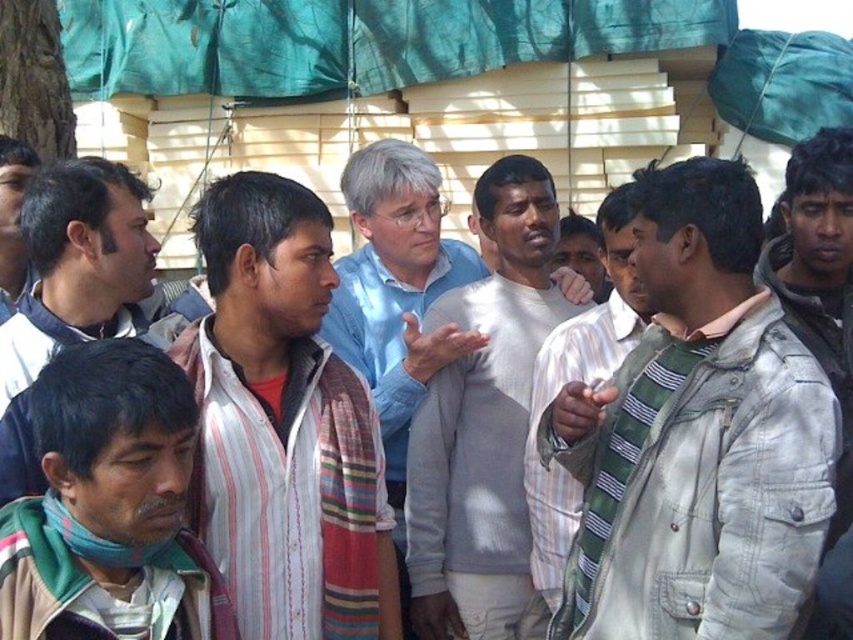
Question: Which point is farther from the camera taking this photo?

Choices:
 (A) click(486, 205)
 (B) click(584, 323)
 (C) click(396, 284)

Answer: (C)

Question: Can you confirm if white striped shirt at center is wider than blue cotton shirt at center?

Choices:
 (A) yes
 (B) no

Answer: (A)

Question: Can you confirm if light gray denim jacket at center is positioned below teal fabric canopy at upper center?

Choices:
 (A) yes
 (B) no

Answer: (A)

Question: Which point appears farthest from the camera in this image?

Choices:
 (A) (575, 506)
 (B) (756, 218)

Answer: (A)

Question: Does green striped scarf at lower left have a greater width compared to striped scarf at center?

Choices:
 (A) no
 (B) yes

Answer: (B)

Question: Which is nearer to the striped fabric shirt at left?

Choices:
 (A) green striped scarf at lower left
 (B) striped scarf at center
 (C) teal fabric canopy at upper center

Answer: (A)